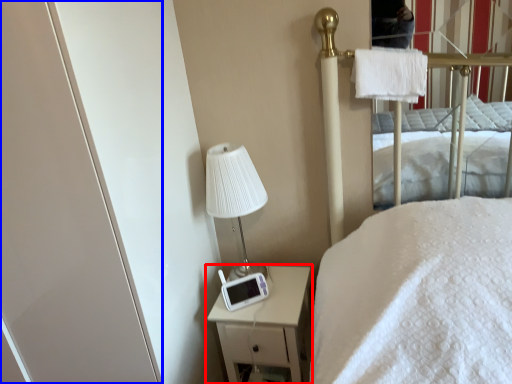
Question: Which object is closer to the camera taking this photo, nightstand (highlighted by a red box) or screen door (highlighted by a blue box)?

Choices:
 (A) nightstand
 (B) screen door

Answer: (B)